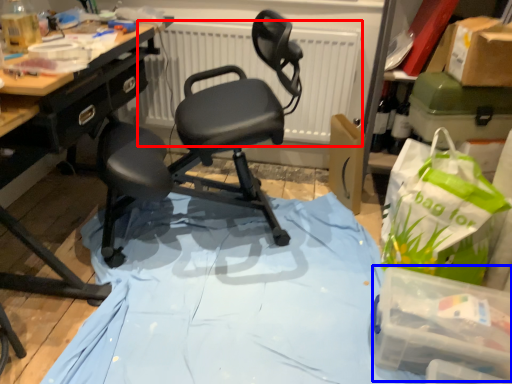
Question: Which object appears farthest to the camera in this image, radiator (highlighted by a red box) or box (highlighted by a blue box)?

Choices:
 (A) radiator
 (B) box

Answer: (A)